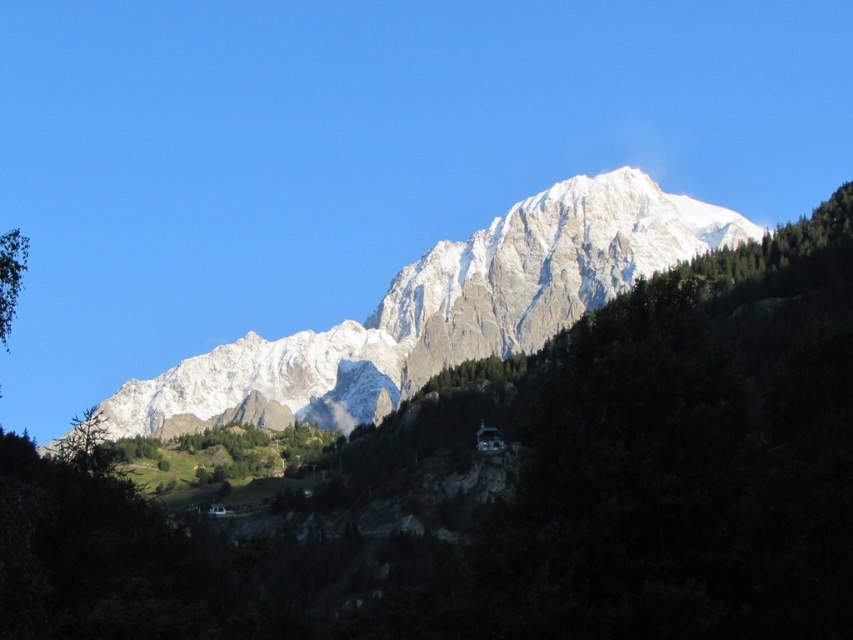
Can you confirm if white crystalline mountain range at center is positioned above green leafy tree at left?

Incorrect, white crystalline mountain range at center is not positioned above green leafy tree at left.

This screenshot has height=640, width=853. Describe the element at coordinates (440, 310) in the screenshot. I see `white crystalline mountain range at center` at that location.

This screenshot has height=640, width=853. I want to click on white crystalline mountain range at center, so click(440, 310).